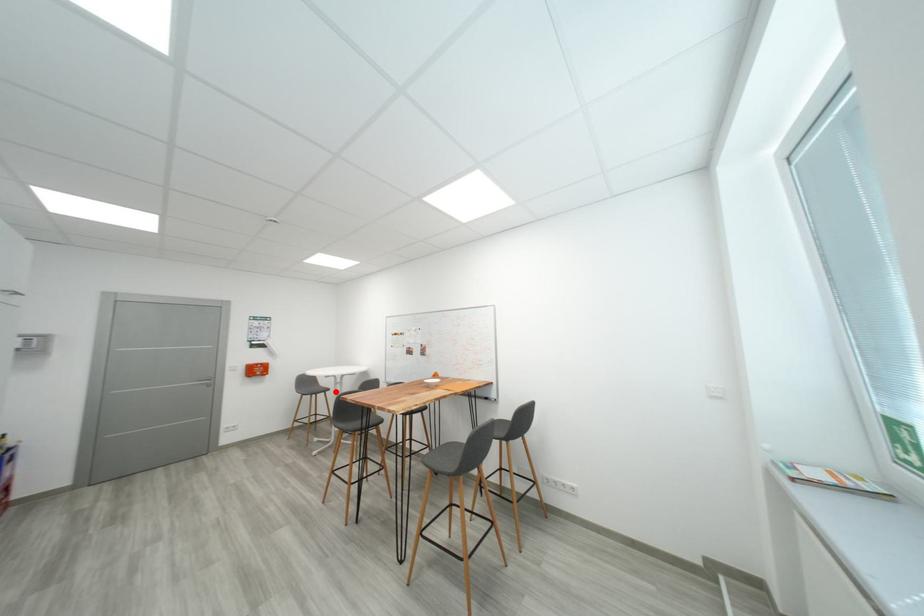
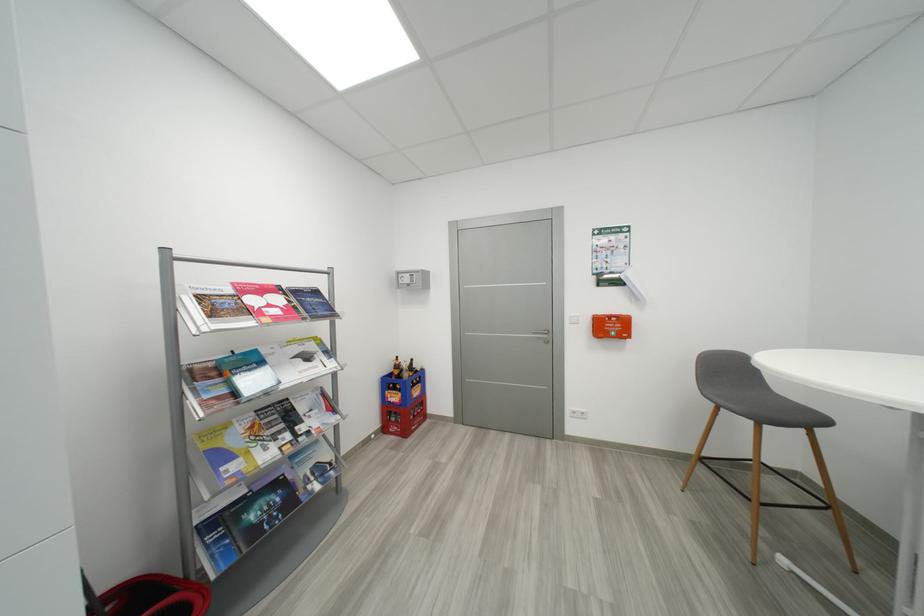
Locate, in the second image, the point that corresponds to the highlighted location in the first image.

(833, 424)